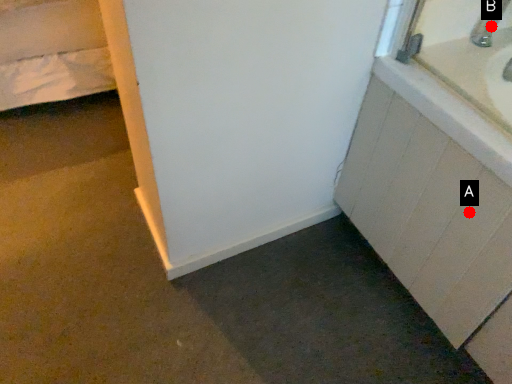
Question: Two points are circled on the image, labeled by A and B beside each circle. Which point is further to the camera?

Choices:
 (A) A is further
 (B) B is further

Answer: (B)